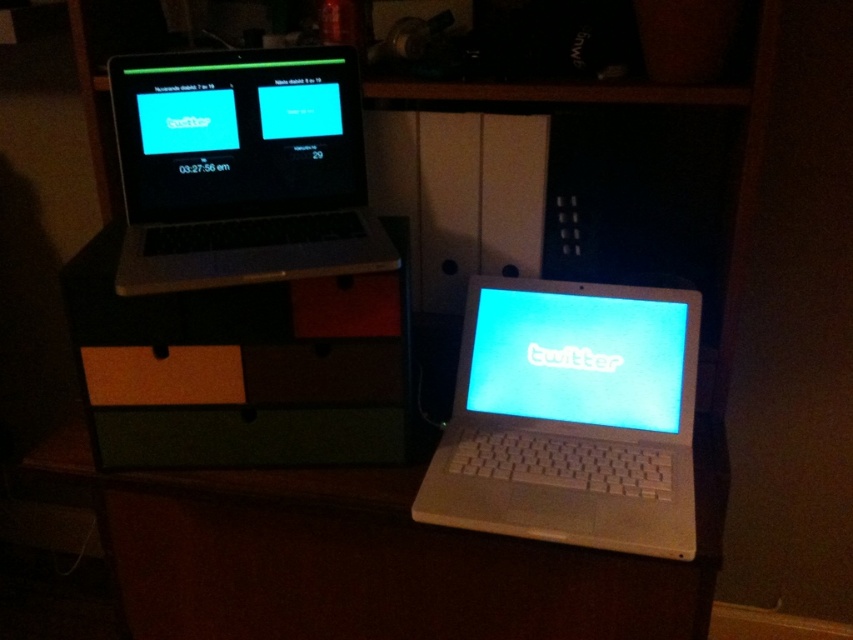
Between white plastic table at lower right and white plastic laptop at center, which one is positioned lower?

white plastic table at lower right is below.

Does white plastic table at lower right appear over white plastic laptop at center?

Incorrect, white plastic table at lower right is not positioned above white plastic laptop at center.

Is point (410, 557) behind point (682, 550)?

Yes, it is.

The image size is (853, 640). Identify the location of white plastic table at lower right. (370, 557).

Looking at this image, who is lower down, white plastic laptop at center or satin black laptop at upper left?

white plastic laptop at center is below.

Can you confirm if white plastic laptop at center is smaller than satin black laptop at upper left?

Actually, white plastic laptop at center might be larger than satin black laptop at upper left.

You are a GUI agent. You are given a task and a screenshot of the screen. Output one action in this format:
    pyautogui.click(x=<x>, y=<y>)
    Task: Click on the white plastic laptop at center
    
    Given the screenshot: What is the action you would take?
    pyautogui.click(x=572, y=417)

Is white plastic table at lower right to the right of satin black laptop at upper left from the viewer's perspective?

Indeed, white plastic table at lower right is positioned on the right side of satin black laptop at upper left.

Is point (140, 604) positioned after point (142, 257)?

That is True.

Locate an element on the screen. The image size is (853, 640). white plastic table at lower right is located at coordinates (370, 557).